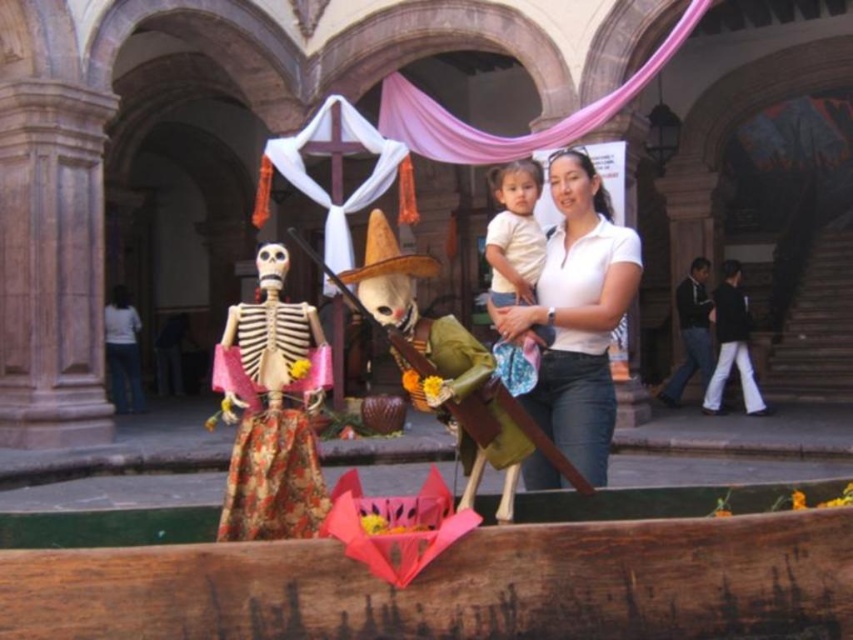
You are standing in the courtyard and want to place a small offering at the closest point between point (223, 525) and point (537, 269). Which point should you approach first?

Point (223, 525) is closer to the viewer than point (537, 269), so you should approach point (223, 525) first.